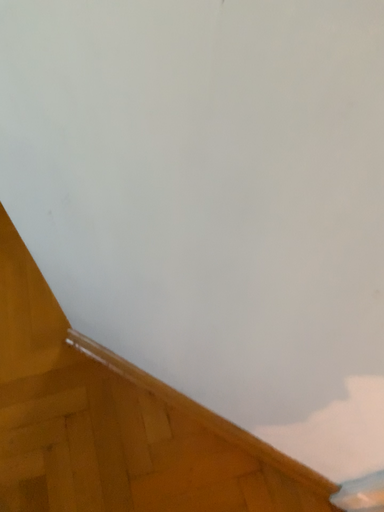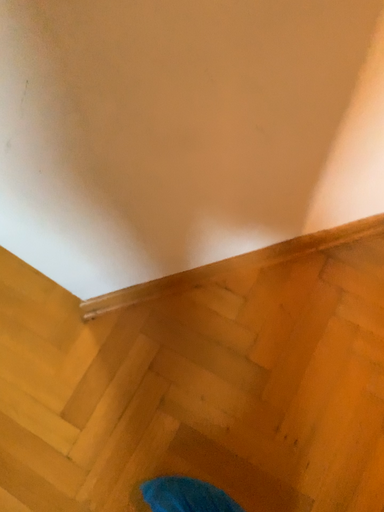
Question: How did the camera likely rotate when shooting the video?

Choices:
 (A) rotated right
 (B) rotated left

Answer: (A)